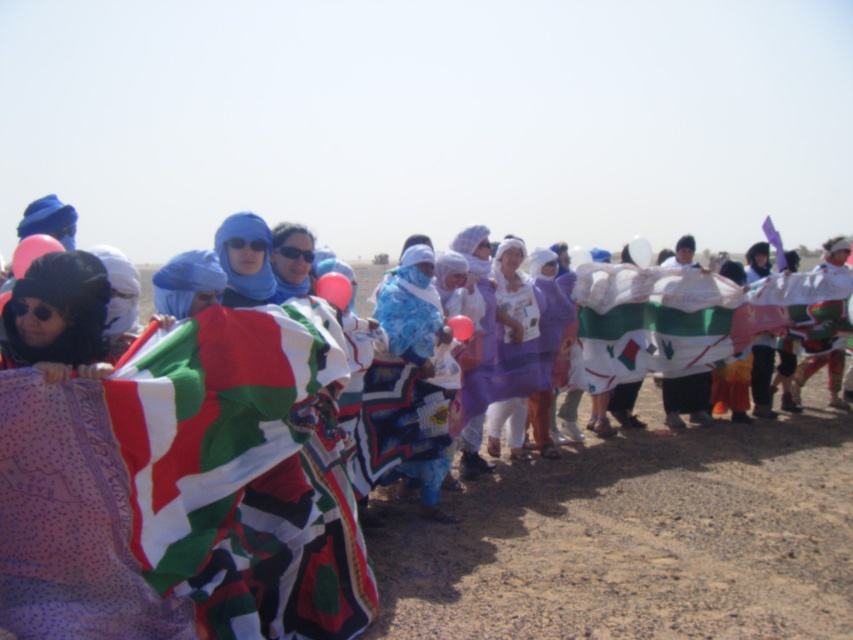
Between printed fabric scarf at center and purple fabric at center, which one is positioned higher?

purple fabric at center

Can you confirm if printed fabric scarf at center is positioned to the left of purple fabric at center?

No, printed fabric scarf at center is not to the left of purple fabric at center.

Is point (656, 394) behind point (520, 316)?

Yes, it is behind point (520, 316).

At what (x,y) coordinates should I click in order to perform the action: click on printed fabric scarf at center. Please return your answer as a coordinate pair (x, y). The width and height of the screenshot is (853, 640). Looking at the image, I should click on (643, 538).